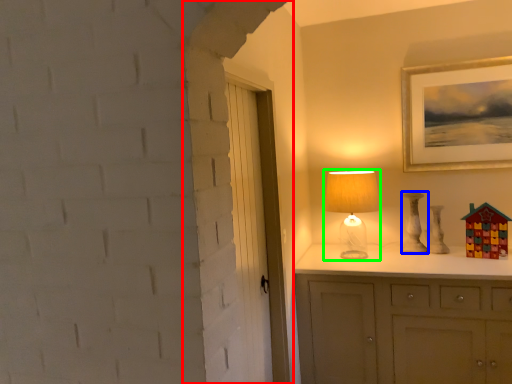
Question: Estimate the real-world distances between objects in this image. Which object is closer to door (highlighted by a red box), lamp (highlighted by a blue box) or table lamp (highlighted by a green box)?

Choices:
 (A) lamp
 (B) table lamp

Answer: (B)